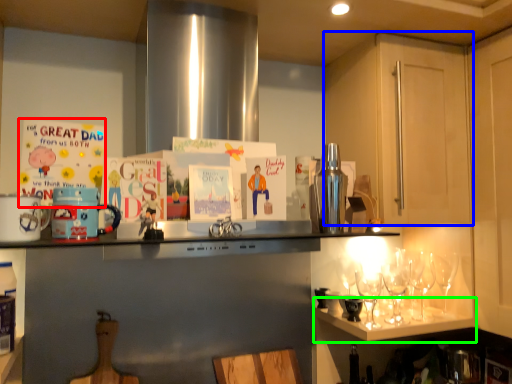
Question: Estimate the real-world distances between objects in this image. Which object is farther from postcard (highlighted by a red box), cabinetry (highlighted by a blue box) or shelf (highlighted by a green box)?

Choices:
 (A) cabinetry
 (B) shelf

Answer: (B)